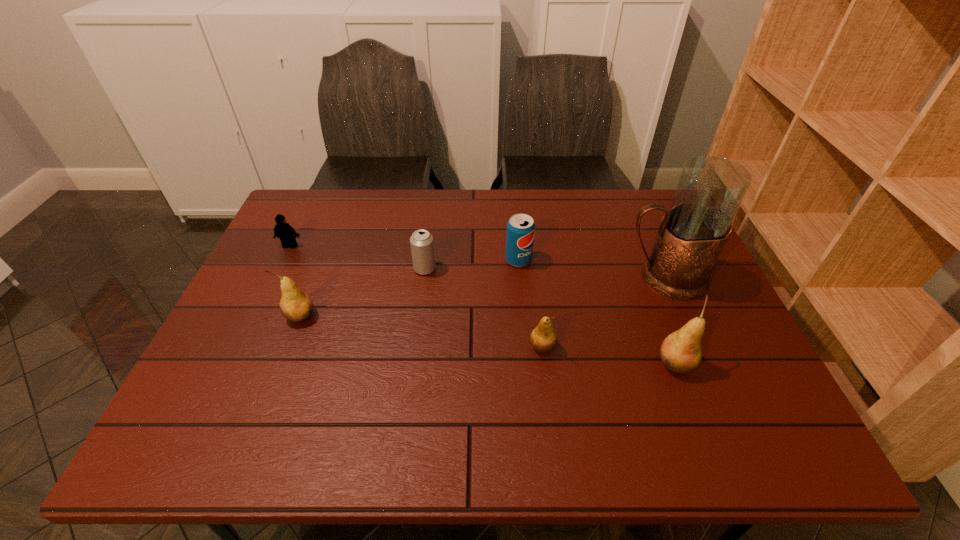
Find the location of `free spot located on the right of the shortest pear`. free spot located on the right of the shortest pear is located at coordinates (673, 347).

Locate an element on the screen. The width and height of the screenshot is (960, 540). free space located 0.180m on the back of the rightmost pear is located at coordinates (649, 294).

Identify the location of vacant space located on the face of the farthest object. The width and height of the screenshot is (960, 540). (258, 312).

Locate an element on the screen. Image resolution: width=960 pixels, height=540 pixels. free space located with the handle on the side of the tallest object is located at coordinates (484, 278).

The width and height of the screenshot is (960, 540). In order to click on vacant space located with the handle on the side of the tallest object in this screenshot , I will do `click(548, 278)`.

Where is `vacant space located with the handle on the side of the tallest object`? vacant space located with the handle on the side of the tallest object is located at coordinates (538, 278).

This screenshot has width=960, height=540. What are the coordinates of `free space located 0.160m on the right of the soda can` in the screenshot? It's located at (587, 260).

Image resolution: width=960 pixels, height=540 pixels. Identify the location of vacant region located on the back of the beer can. (435, 191).

What are the coordinates of `object situated at the near edge` in the screenshot? It's located at (681, 351).

At what (x,y) coordinates should I click in order to perform the action: click on pear that is positioned at the left edge. Please return your answer as a coordinate pair (x, y). The image size is (960, 540). Looking at the image, I should click on (295, 305).